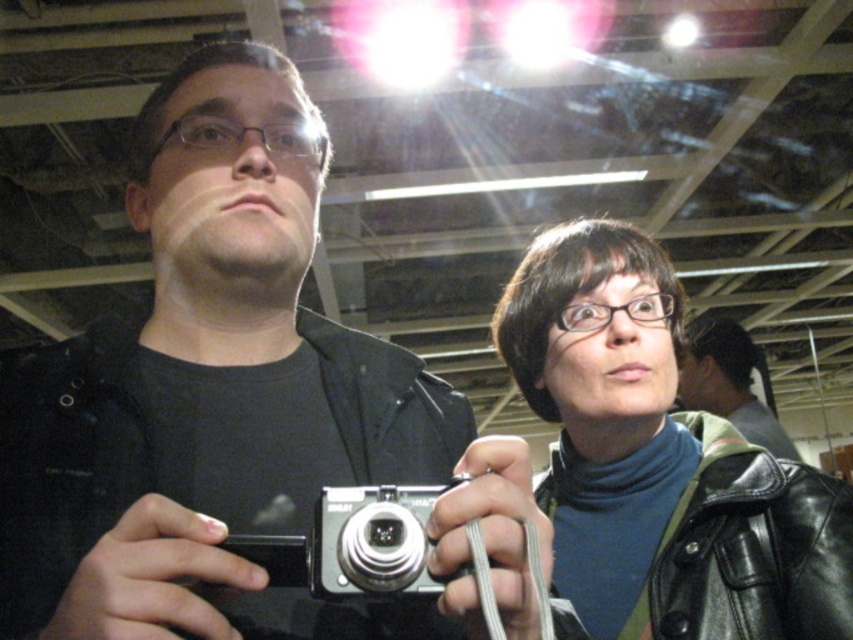
You are standing in a room with an industrial ceiling. You see a black leather jacket at upper right and a silver metallic camera at center. Which object is closer to the ceiling beams?

The silver metallic camera at center is closer to the ceiling beams because the black leather jacket at upper right is positioned under it.

You are standing at the origin point in the image. Which of the two points, point (662,317) or point (392,596), is farther away from you?

Point (662,317) is farther away from you because it is behind point (392,596).

You are a photographer at an event and you see the black leather jacket at upper right and the silver metallic camera at center. Which object is located more to the right?

The black leather jacket at upper right is positioned on the right side of the silver metallic camera at center, so it is more to the right.